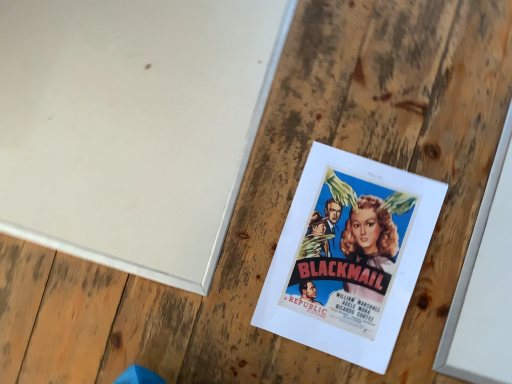
Question: Considering the positions of matte paper poster at center and white matte bulletin board at upper left in the image, is matte paper poster at center taller or shorter than white matte bulletin board at upper left?

Choices:
 (A) tall
 (B) short

Answer: (A)

Question: From the image's perspective, is matte paper poster at center above or below white matte bulletin board at upper left?

Choices:
 (A) above
 (B) below

Answer: (B)

Question: Relative to white matte bulletin board at upper left, is matte paper poster at center in front or behind?

Choices:
 (A) front
 (B) behind

Answer: (A)

Question: From the image's perspective, is white matte bulletin board at upper left positioned above or below matte paper poster at center?

Choices:
 (A) above
 (B) below

Answer: (A)

Question: From a real-world perspective, is white matte bulletin board at upper left positioned above or below matte paper poster at center?

Choices:
 (A) below
 (B) above

Answer: (A)

Question: Considering the positions of white matte bulletin board at upper left and matte paper poster at center in the image, is white matte bulletin board at upper left taller or shorter than matte paper poster at center?

Choices:
 (A) short
 (B) tall

Answer: (A)

Question: Does point (88, 208) appear closer or farther from the camera than point (272, 312)?

Choices:
 (A) farther
 (B) closer

Answer: (A)